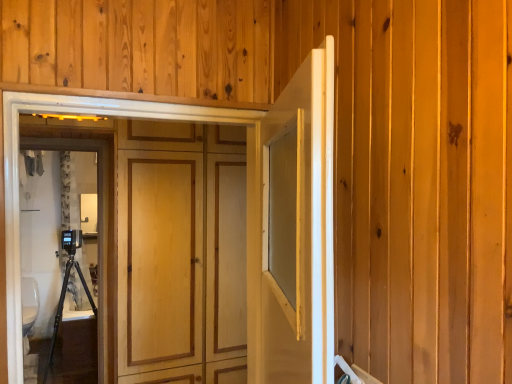
Question: Should I look upward or downward to see white glossy toilet bowl at lower left?

Choices:
 (A) down
 (B) up

Answer: (A)

Question: Is wooden panel at center, placed as the first door when sorted from left to right, shorter than white glossy door at center, positioned as the first door in right-to-left order?

Choices:
 (A) no
 (B) yes

Answer: (A)

Question: Is white glossy door at center, positioned as the first door in right-to-left order, surrounded by wooden panel at center, placed as the first door when sorted from left to right?

Choices:
 (A) yes
 (B) no

Answer: (B)

Question: Does wooden panel at center, which ranks as the second door in right-to-left order, have a larger size compared to white glossy door at center, positioned as the first door in right-to-left order?

Choices:
 (A) yes
 (B) no

Answer: (B)

Question: Is wooden panel at center, placed as the first door when sorted from left to right, completely or partially outside of white glossy door at center, positioned as the first door in right-to-left order?

Choices:
 (A) yes
 (B) no

Answer: (A)

Question: Considering the relative sizes of wooden panel at center, which ranks as the second door in right-to-left order, and white glossy door at center, positioned as the first door in right-to-left order, in the image provided, is wooden panel at center, which ranks as the second door in right-to-left order, wider than white glossy door at center, positioned as the first door in right-to-left order,?

Choices:
 (A) no
 (B) yes

Answer: (B)

Question: Is wooden panel at center, placed as the first door when sorted from left to right, oriented away from white glossy door at center, positioned as the first door in right-to-left order?

Choices:
 (A) no
 (B) yes

Answer: (B)

Question: Is white glossy toilet bowl at lower left further to the viewer compared to wooden panel at center, placed as the first door when sorted from left to right?

Choices:
 (A) no
 (B) yes

Answer: (B)

Question: Is white glossy toilet bowl at lower left facing towards wooden panel at center, which ranks as the second door in right-to-left order?

Choices:
 (A) no
 (B) yes

Answer: (B)

Question: Is there a large distance between white glossy toilet bowl at lower left and wooden panel at center, placed as the first door when sorted from left to right?

Choices:
 (A) no
 (B) yes

Answer: (B)

Question: Is white glossy toilet bowl at lower left positioned with its back to wooden panel at center, placed as the first door when sorted from left to right?

Choices:
 (A) no
 (B) yes

Answer: (A)

Question: Would you say white glossy toilet bowl at lower left is outside wooden panel at center, which ranks as the second door in right-to-left order?

Choices:
 (A) no
 (B) yes

Answer: (B)

Question: Considering the relative sizes of white glossy toilet bowl at lower left and wooden panel at center, which ranks as the second door in right-to-left order, in the image provided, is white glossy toilet bowl at lower left smaller than wooden panel at center, which ranks as the second door in right-to-left order,?

Choices:
 (A) no
 (B) yes

Answer: (A)

Question: Does black plastic camera on the left turn towards white glossy door at center, positioned as the first door in right-to-left order?

Choices:
 (A) yes
 (B) no

Answer: (A)